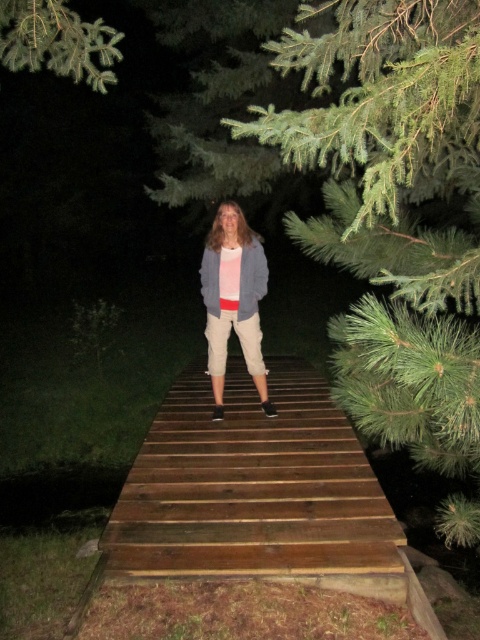
Consider the image. Is the position of light gray cotton hoodie at center more distant than that of green needle-like leaves at upper left?

That is True.

At what (x,y) coordinates should I click in order to perform the action: click on light gray cotton hoodie at center. Please return your answer as a coordinate pair (x, y). Looking at the image, I should click on coord(233,300).

This screenshot has width=480, height=640. What are the coordinates of `light gray cotton hoodie at center` in the screenshot? It's located at (233, 300).

Can you confirm if wooden bridge at center is taller than light gray cotton hoodie at center?

In fact, wooden bridge at center may be shorter than light gray cotton hoodie at center.

Is wooden bridge at center positioned at the back of light gray cotton hoodie at center?

No, wooden bridge at center is closer to the viewer.

Is point (349, 500) farther from viewer compared to point (243, 256)?

No, (349, 500) is in front of (243, 256).

Locate an element on the screen. The width and height of the screenshot is (480, 640). wooden bridge at center is located at coordinates (255, 490).

Between wooden bridge at center and green needle-like leaves at upper left, which one appears on the right side from the viewer's perspective?

wooden bridge at center

Is point (308, 465) positioned behind point (96, 20)?

No, it is in front of (96, 20).

This screenshot has width=480, height=640. Find the location of `wooden bridge at center`. wooden bridge at center is located at coordinates (255, 490).